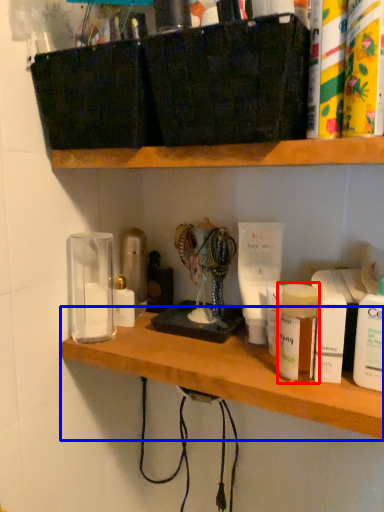
Question: Which object is closer to the camera taking this photo, toiletry (highlighted by a red box) or shelf (highlighted by a blue box)?

Choices:
 (A) toiletry
 (B) shelf

Answer: (B)